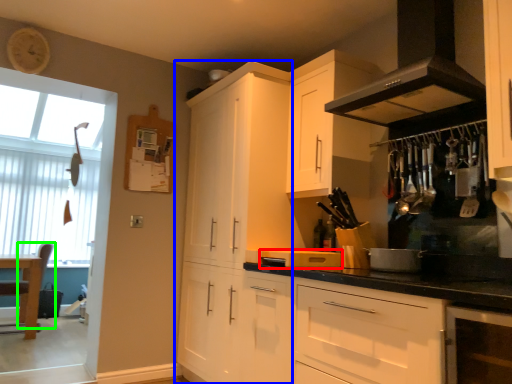
Question: Estimate the real-world distances between objects in this image. Which object is farther from appliance (highlighted by a red box), cabinetry (highlighted by a blue box) or chair (highlighted by a green box)?

Choices:
 (A) cabinetry
 (B) chair

Answer: (B)